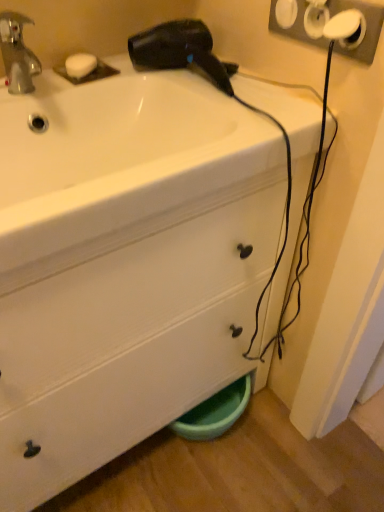
The width and height of the screenshot is (384, 512). Identify the location of vacant location below black plastic hair dryer at upper center (from a real-world perspective). (188, 78).